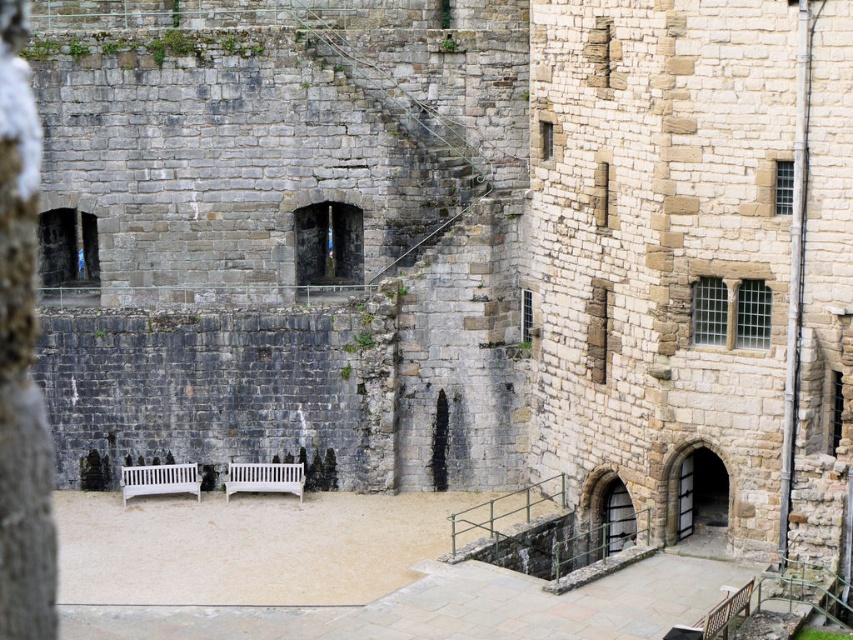
You are a tourist visiting the historic stone structure and want to sit on one of the benches. Which bench, the white wooden bench at lower left or the white wooden bench at center, is positioned lower in the image?

The white wooden bench at lower left is positioned lower in the image than the white wooden bench at center.